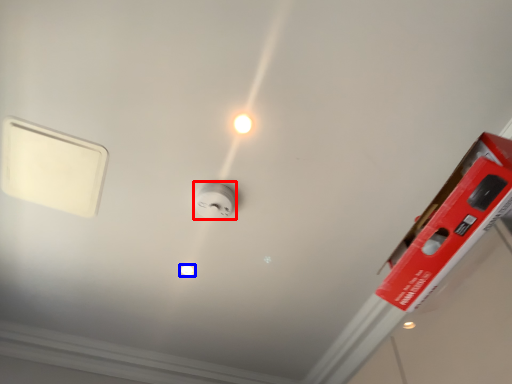
Question: Which point is further to the camera, power plugs and sockets (highlighted by a red box) or light bulb (highlighted by a blue box)?

Choices:
 (A) power plugs and sockets
 (B) light bulb

Answer: (B)